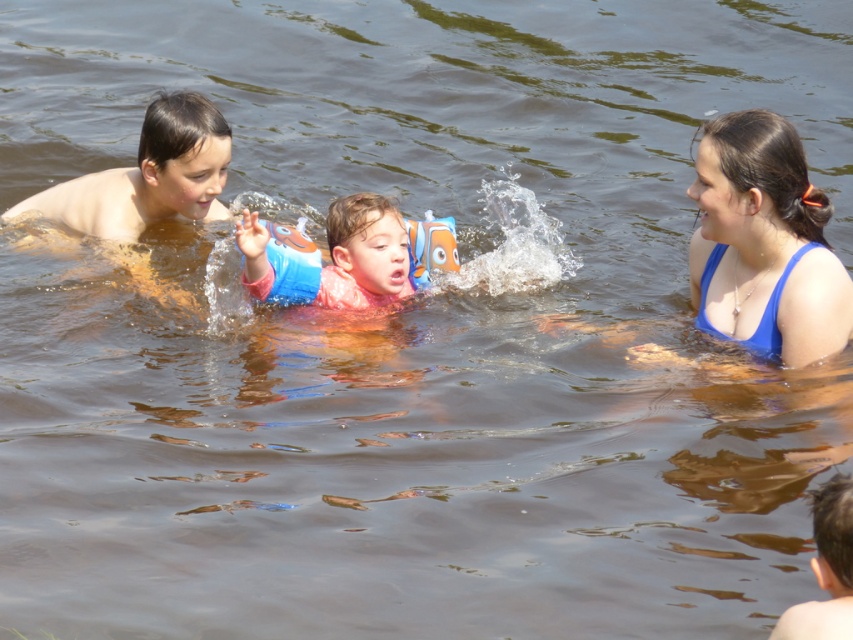
Question: Among these points, which one is nearest to the camera?

Choices:
 (A) (186, 182)
 (B) (846, 634)
 (C) (824, 240)
 (D) (271, 232)

Answer: (B)

Question: Is blue fabric at right wider than light brown skin at left?

Choices:
 (A) yes
 (B) no

Answer: (B)

Question: Which point is closer to the camera taking this photo?

Choices:
 (A) (167, 209)
 (B) (816, 534)
 (C) (799, 140)

Answer: (B)

Question: Is blue fabric at right closer to camera compared to blonde hair boy at lower right?

Choices:
 (A) yes
 (B) no

Answer: (B)

Question: Where is blue fabric at right located in relation to light brown skin at left in the image?

Choices:
 (A) below
 (B) above

Answer: (A)

Question: Which of the following is the closest to the observer?

Choices:
 (A) light brown skin at left
 (B) blonde hair boy at lower right
 (C) blue fabric at right
 (D) blue rubber arm band at center

Answer: (B)